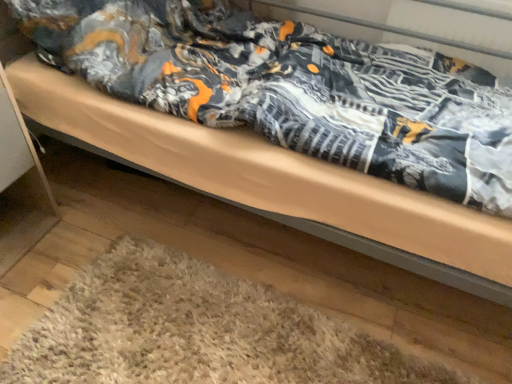
Locate an element on the screen. The height and width of the screenshot is (384, 512). unoccupied space behind beige shaggy rug at lower center is located at coordinates (221, 234).